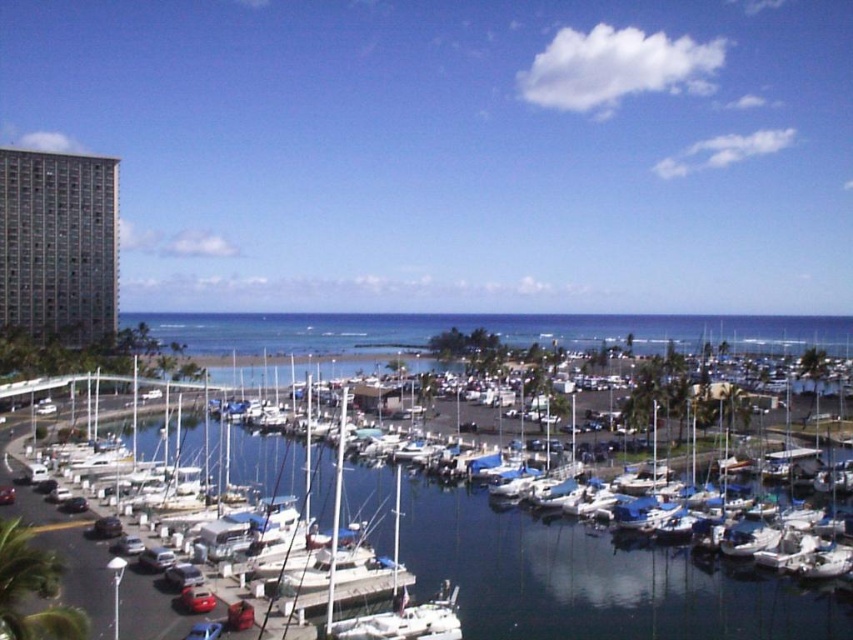
Who is lower down, gray glass building at left or blue tarpaulin boat at center?

blue tarpaulin boat at center is below.

Is point (39, 156) more distant than point (323, 612)?

That is True.

Which is in front, point (44, 186) or point (263, 614)?

Point (263, 614)

The image size is (853, 640). Identify the location of gray glass building at left. (57, 244).